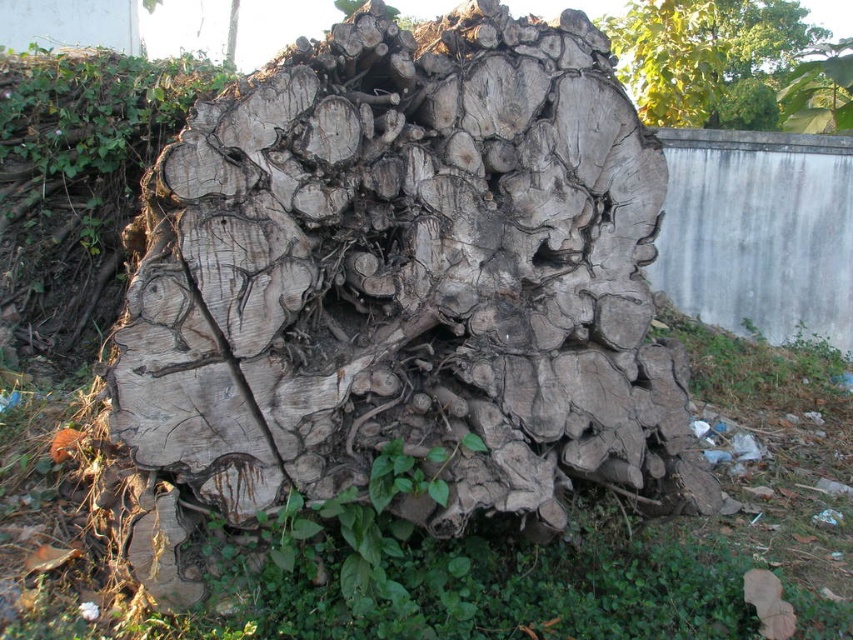
Who is lower down, weathered wood log at center or green leafy tree at upper center?

Positioned lower is weathered wood log at center.

Can you confirm if weathered wood log at center is smaller than green leafy tree at upper center?

Indeed, weathered wood log at center has a smaller size compared to green leafy tree at upper center.

Where is `weathered wood log at center`? The height and width of the screenshot is (640, 853). weathered wood log at center is located at coordinates (401, 285).